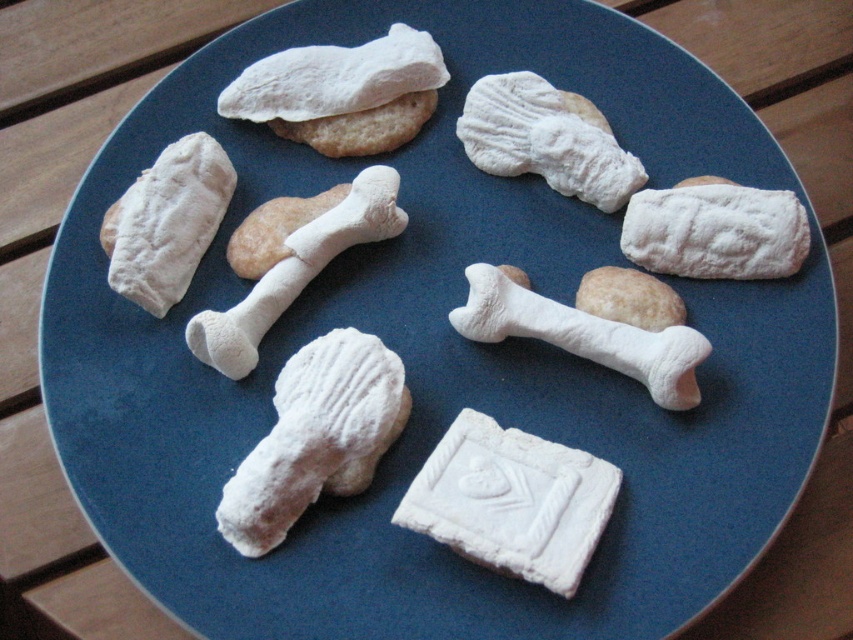
Can you confirm if powdered white bone at upper right is taller than powdered white bone at upper center?

In fact, powdered white bone at upper right may be shorter than powdered white bone at upper center.

Does powdered white bone at upper right have a lesser height compared to powdered white bone at upper center?

Yes, powdered white bone at upper right is shorter than powdered white bone at upper center.

Which is in front, point (744, 196) or point (526, 122)?

Point (744, 196) is more forward.

Identify the location of powdered white bone at upper right. The image size is (853, 640). (715, 230).

Which of these two, powdered white bone at upper right or white matte bone at center, stands taller?

Standing taller between the two is white matte bone at center.

Who is more forward, [746,257] or [648,340]?

Point [648,340] is more forward.

Where is `powdered white bone at upper right`? This screenshot has width=853, height=640. powdered white bone at upper right is located at coordinates (715, 230).

Can you confirm if white matte bone at center is positioned above white fluffy bone at center?

Incorrect, white matte bone at center is not positioned above white fluffy bone at center.

Is white matte bone at center wider than white fluffy bone at center?

Yes.

Which is in front, point (483, 305) or point (364, 208)?

Positioned in front is point (483, 305).

I want to click on white matte bone at center, so click(583, 336).